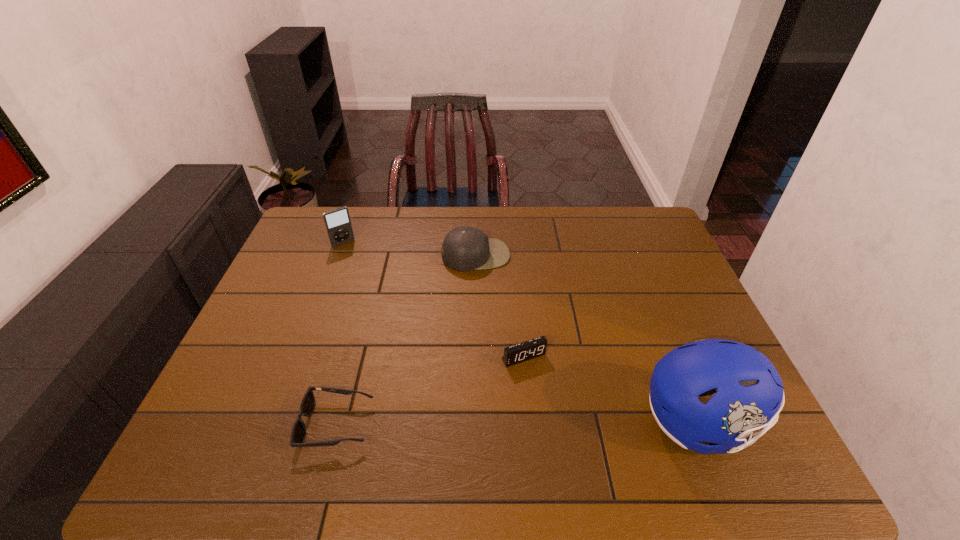
The height and width of the screenshot is (540, 960). Find the location of `sunglasses`. sunglasses is located at coordinates (307, 405).

Image resolution: width=960 pixels, height=540 pixels. In order to click on the shortest object in this screenshot , I will do `click(307, 405)`.

Where is `football helmet`? football helmet is located at coordinates (750, 392).

Where is `the rightmost object`? the rightmost object is located at coordinates (750, 392).

I want to click on iPod, so click(x=338, y=224).

Where is `the second tallest object`? The height and width of the screenshot is (540, 960). the second tallest object is located at coordinates (338, 224).

The width and height of the screenshot is (960, 540). I want to click on cap, so click(x=466, y=248).

This screenshot has height=540, width=960. What are the coordinates of `the third farthest object` in the screenshot? It's located at (534, 348).

Find the location of a particular element. This screenshot has height=540, width=960. alarm clock is located at coordinates click(x=534, y=348).

What are the coordinates of `vacant area located on the front-facing side of the shortest object` in the screenshot? It's located at (218, 424).